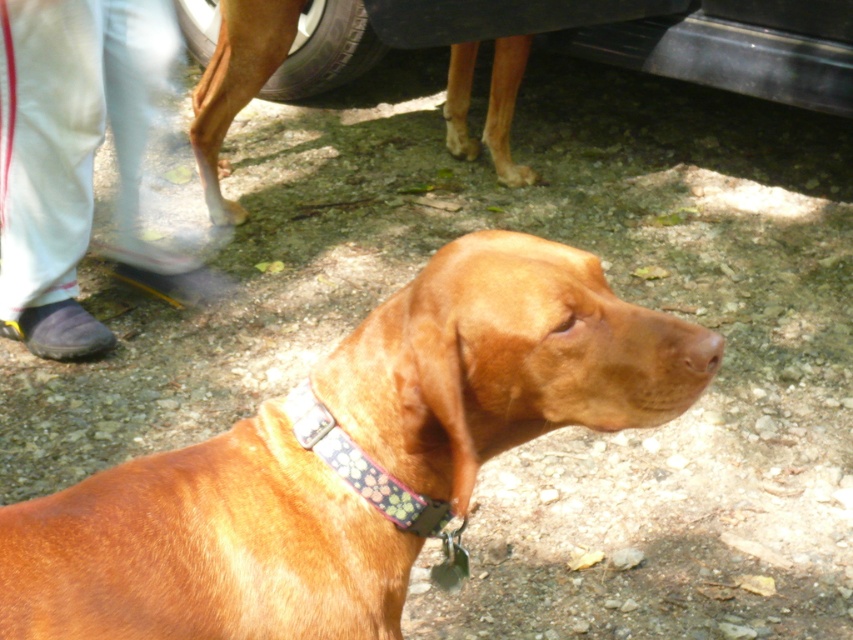
Question: Which object appears farthest from the camera in this image?

Choices:
 (A) brown fabric dog at center
 (B) black rubber tire at upper center
 (C) brown leather dog at center
 (D) brown matte nose at center

Answer: (C)

Question: Does floral fabric collar at center lie in front of brown matte nose at center?

Choices:
 (A) yes
 (B) no

Answer: (B)

Question: Does brown fabric dog at center appear on the right side of brown leather dog at center?

Choices:
 (A) no
 (B) yes

Answer: (A)

Question: Is brown fabric dog at center above brown leather dog at center?

Choices:
 (A) no
 (B) yes

Answer: (A)

Question: Which of the following is the closest to the observer?

Choices:
 (A) brown leather dog at center
 (B) brown matte nose at center

Answer: (B)

Question: Which of the following is the closest to the observer?

Choices:
 (A) (509, 177)
 (B) (283, 100)

Answer: (A)